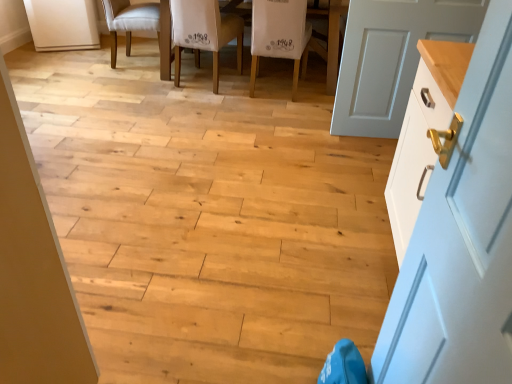
Question: Considering the relative sizes of white painted wood door at right, which is counted as the 1th door, starting from the top, and white fabric chair at center, marked as the first chair in a right-to-left arrangement, in the image provided, is white painted wood door at right, which is counted as the 1th door, starting from the top, bigger than white fabric chair at center, marked as the first chair in a right-to-left arrangement,?

Choices:
 (A) no
 (B) yes

Answer: (A)

Question: From a real-world perspective, is white painted wood door at right, which is counted as the 1th door, starting from the top, physically above white fabric chair at center, marked as the first chair in a right-to-left arrangement?

Choices:
 (A) yes
 (B) no

Answer: (A)

Question: Considering the relative sizes of white painted wood door at right, the second door when ordered from left to right, and white fabric chair at center, marked as the first chair in a right-to-left arrangement, in the image provided, is white painted wood door at right, the second door when ordered from left to right, shorter than white fabric chair at center, marked as the first chair in a right-to-left arrangement,?

Choices:
 (A) no
 (B) yes

Answer: (A)

Question: Is white painted wood door at right, the second door when ordered from left to right, next to white fabric chair at center, the third chair viewed from the left?

Choices:
 (A) no
 (B) yes

Answer: (A)

Question: Does point (463, 14) appear closer or farther from the camera than point (354, 240)?

Choices:
 (A) farther
 (B) closer

Answer: (A)

Question: Considering the relative positions of white painted wood door at right, the 1th door positioned from the back, and wooden floor at center in the image provided, is white painted wood door at right, the 1th door positioned from the back, to the left or to the right of wooden floor at center?

Choices:
 (A) right
 (B) left

Answer: (A)

Question: Choose the correct answer: Is white painted wood door at right, the 1th door positioned from the back, inside wooden floor at center or outside it?

Choices:
 (A) inside
 (B) outside

Answer: (B)

Question: In the image, is white painted wood door at right, the 1th door positioned from the back, positioned in front of or behind wooden floor at center?

Choices:
 (A) front
 (B) behind

Answer: (B)

Question: From a real-world perspective, is white fabric chair at upper center, which appears as the third chair when viewed from the right, physically located above or below wooden table at center?

Choices:
 (A) above
 (B) below

Answer: (B)

Question: Considering the positions of white fabric chair at upper center, which appears as the third chair when viewed from the right, and wooden table at center in the image, is white fabric chair at upper center, which appears as the third chair when viewed from the right, bigger or smaller than wooden table at center?

Choices:
 (A) big
 (B) small

Answer: (B)

Question: Would you say white fabric chair at upper center, which appears as the third chair when viewed from the right, is to the left or to the right of wooden table at center in the picture?

Choices:
 (A) left
 (B) right

Answer: (A)

Question: Considering the positions of white fabric chair at upper center, which appears as the first chair when viewed from the left, and wooden table at center in the image, is white fabric chair at upper center, which appears as the first chair when viewed from the left, wider or thinner than wooden table at center?

Choices:
 (A) thin
 (B) wide

Answer: (A)

Question: Is point (178, 34) closer or farther from the camera than point (189, 324)?

Choices:
 (A) closer
 (B) farther

Answer: (B)

Question: In the image, is white fabric chair at center, which is the 2th chair from right to left, on the left side or the right side of wooden floor at center?

Choices:
 (A) left
 (B) right

Answer: (B)